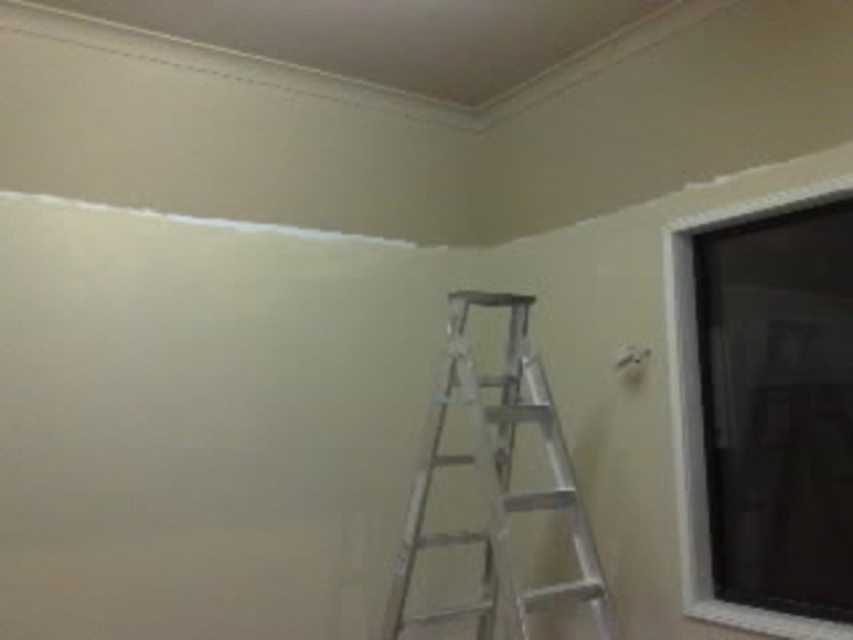
Who is more forward, [473,536] or [688,508]?

Point [688,508] is more forward.

Is silver metallic ladder at center shorter than clear glass window at upper right?

Indeed, silver metallic ladder at center has a lesser height compared to clear glass window at upper right.

Is point (425, 436) more distant than point (663, 292)?

No, (425, 436) is closer to viewer.

This screenshot has height=640, width=853. I want to click on silver metallic ladder at center, so click(497, 480).